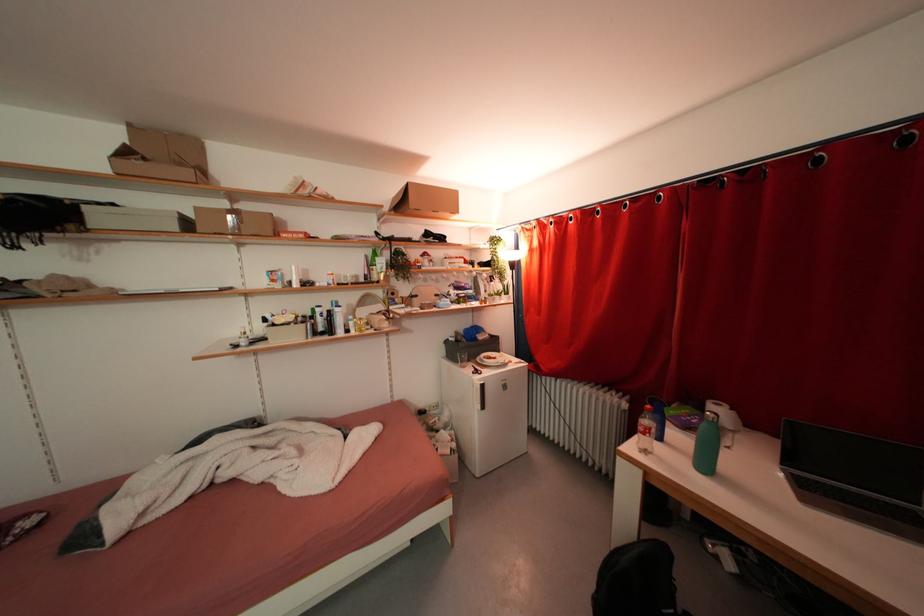
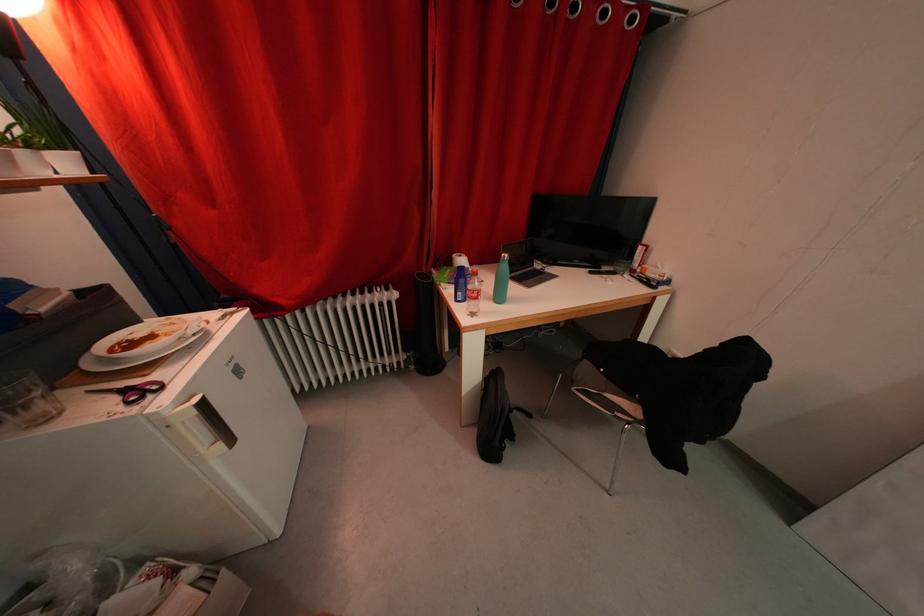
Question: I am providing you with two images of the same scene from different viewpoints. Please identify which objects are invisible in image2.

Choices:
 (A) pair of scissors
 (B) fridge door handle
 (C) black tower fan
 (D) none of these

Answer: (D)